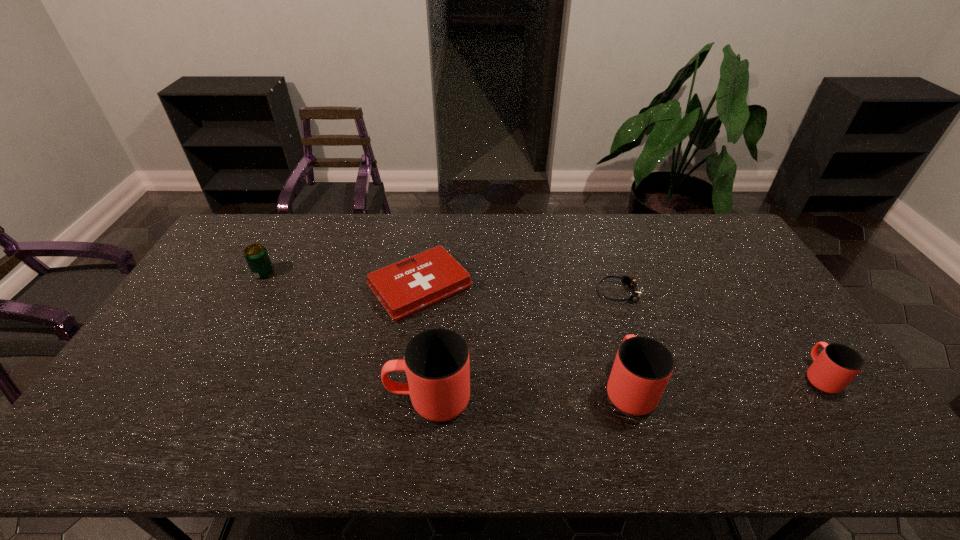
You are a GUI agent. You are given a task and a screenshot of the screen. Output one action in this format:
    pyautogui.click(x=<x>, y=<y>)
    Task: Click on the vacant region that satisfies the following two spatial constraints: 1. on the handle side of the shortest cup; 2. through the lenses of the goggles
    The width and height of the screenshot is (960, 540).
    Given the screenshot: What is the action you would take?
    pyautogui.click(x=762, y=293)

In order to click on free space that satisfies the following two spatial constraints: 1. on the handle side of the leftmost cup; 2. on the front side of the first-aid kit in this screenshot , I will do `click(440, 287)`.

Locate an element on the screen. Image resolution: width=960 pixels, height=540 pixels. vacant space that satisfies the following two spatial constraints: 1. on the handle side of the leftmost cup; 2. on the handle side of the rightmost cup is located at coordinates (431, 376).

Locate an element on the screen. vacant space that satisfies the following two spatial constraints: 1. on the handle side of the rightmost object; 2. through the lenses of the goggles is located at coordinates (762, 293).